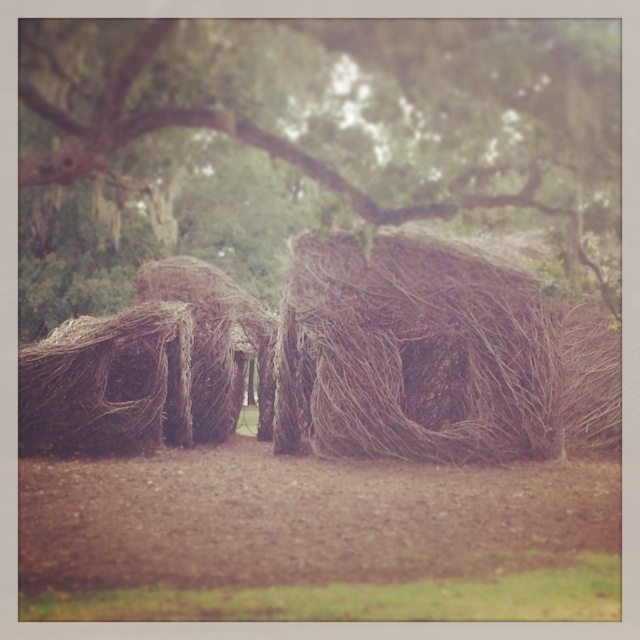
Question: Which point is farther to the camera?

Choices:
 (A) (156, 344)
 (B) (572, 198)
 (C) (547, 342)

Answer: (A)

Question: Which point is closer to the camera?

Choices:
 (A) (380, 186)
 (B) (170, 355)
 (C) (520, 356)

Answer: (A)

Question: Does brown woven hut at center appear on the right side of brown woven basket at left?

Choices:
 (A) yes
 (B) no

Answer: (A)

Question: Among these points, which one is nearest to the camera?

Choices:
 (A) (20, 397)
 (B) (550, 333)
 (C) (497, 180)

Answer: (C)

Question: Is brown woven hut at center smaller than brown woven basket at left?

Choices:
 (A) yes
 (B) no

Answer: (B)

Question: Does brown woven structure at center have a larger size compared to brown woven hut at center?

Choices:
 (A) yes
 (B) no

Answer: (A)